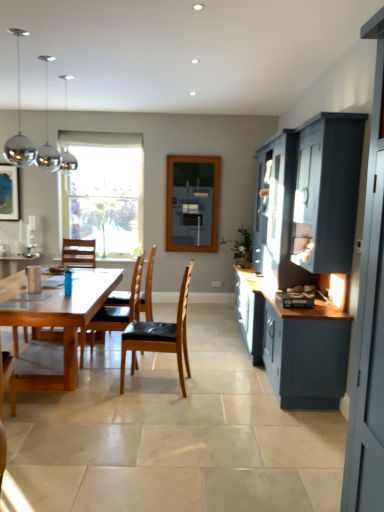
Where is `free area below light brown wooden chair at center, acting as the 1th chair starting from the front (from a real-world perspective)`? The image size is (384, 512). free area below light brown wooden chair at center, acting as the 1th chair starting from the front (from a real-world perspective) is located at coordinates (151, 386).